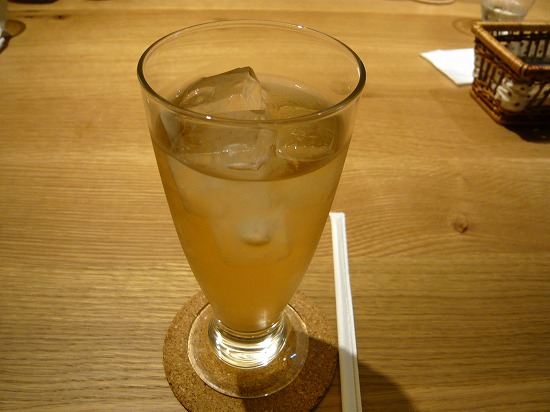
Find the location of a particular element. basket is located at coordinates (509, 69).